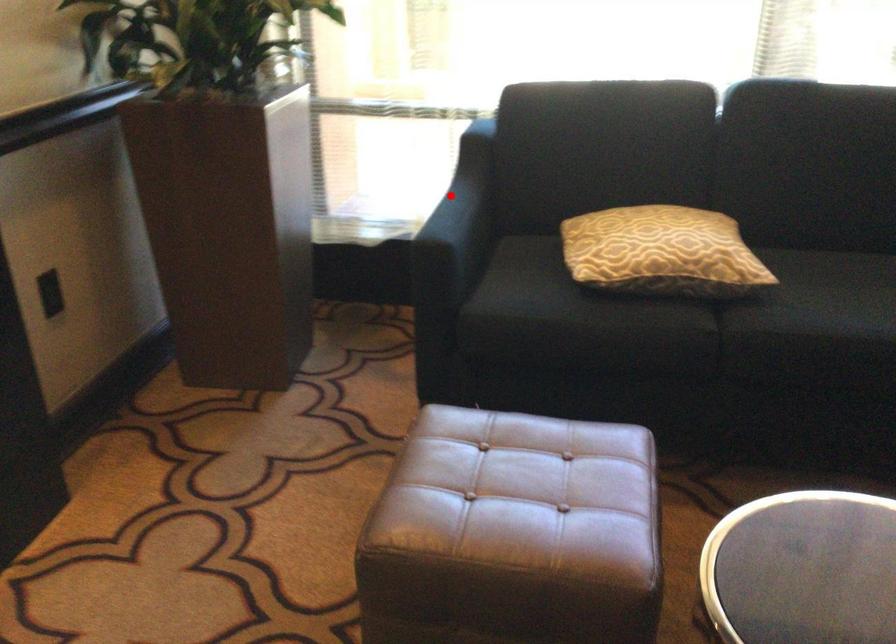
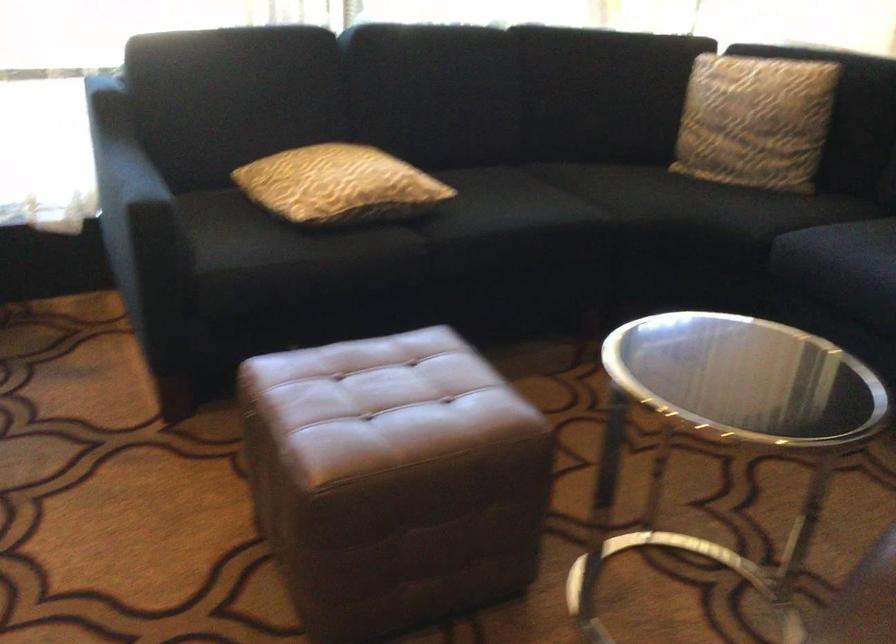
Question: A red point is marked in image1. In image2, is the corresponding 3D point closer to the camera or farther? Reply with the corresponding letter.

Choices:
 (A) The corresponding 3D point is closer.
 (B) The corresponding 3D point is farther.

Answer: (A)